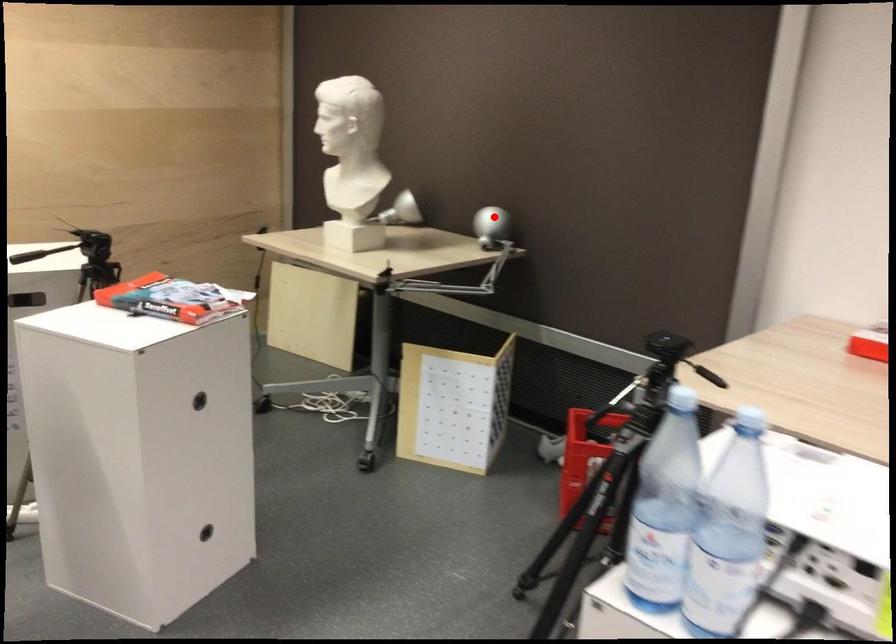
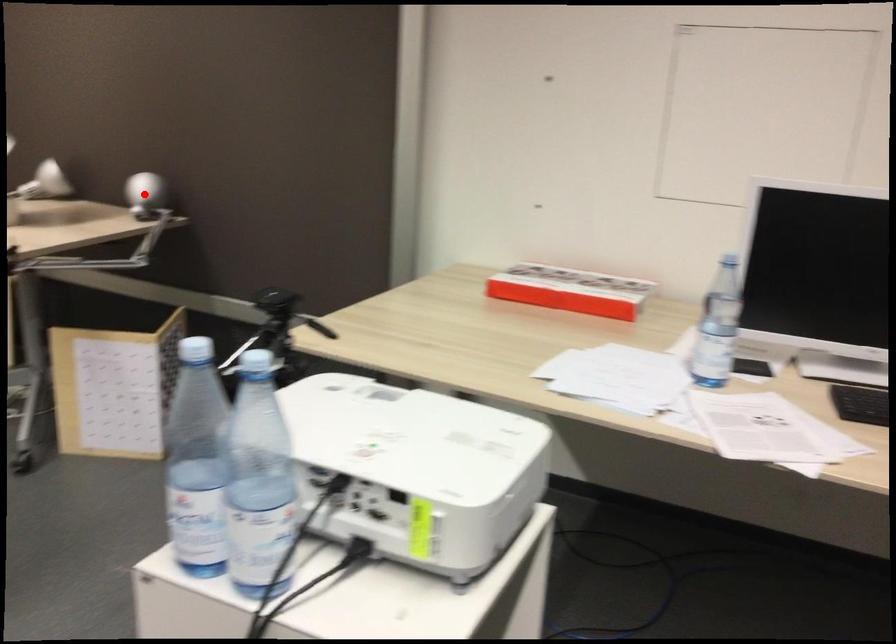
I am providing you with two images of the same scene from different viewpoints. A red point is marked on the first image and another point is marked on the second image. Does the point marked in image1 correspond to the same location as the one in image2?

Yes